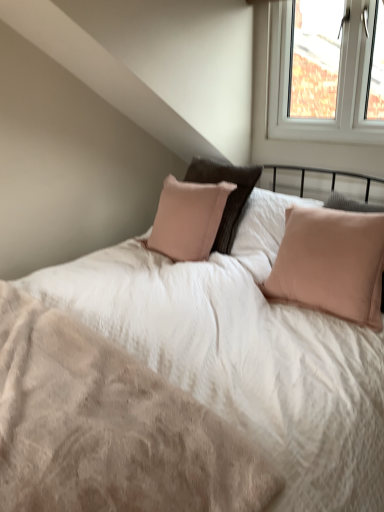
Where is `white plastic window at upper right`? The width and height of the screenshot is (384, 512). white plastic window at upper right is located at coordinates (326, 71).

What do you see at coordinates (108, 426) in the screenshot? I see `beige soft fabric mattress at center` at bounding box center [108, 426].

Measure the distance between point (199, 463) and camera.

Point (199, 463) is 33.62 inches from camera.

Where is `pale pink fabric pillow at right`? This screenshot has width=384, height=512. pale pink fabric pillow at right is located at coordinates (331, 263).

Is white plastic window at upper right bigger than beige soft fabric mattress at center?

Actually, white plastic window at upper right might be smaller than beige soft fabric mattress at center.

Consider the image. Is beige soft fabric mattress at center inside white plastic window at upper right?

Definitely not — beige soft fabric mattress at center is not inside white plastic window at upper right.

From a real-world perspective, is white plastic window at upper right physically located above or below beige soft fabric mattress at center?

Clearly, from a real-world perspective, white plastic window at upper right is above beige soft fabric mattress at center.

Visually, is white plastic window at upper right positioned to the left or to the right of beige soft fabric mattress at center?

white plastic window at upper right is positioned on beige soft fabric mattress at center's right side.

Which of these two, pale pink fabric pillow at right or white plastic window at upper right, is bigger?

With larger size is pale pink fabric pillow at right.

Considering the sizes of objects pale pink fabric pillow at right and white plastic window at upper right in the image provided, who is shorter, pale pink fabric pillow at right or white plastic window at upper right?

With less height is pale pink fabric pillow at right.

Is pale pink fabric pillow at right not inside white plastic window at upper right?

Yes, pale pink fabric pillow at right is located beyond the bounds of white plastic window at upper right.

Could you tell me if pale pink fabric pillow at right is facing white plastic window at upper right?

No.

How much distance is there between beige soft fabric mattress at center and white plastic window at upper right?

6.36 feet.

Is beige soft fabric mattress at center spatially inside white plastic window at upper right, or outside of it?

beige soft fabric mattress at center is spatially situated outside white plastic window at upper right.

Is beige soft fabric mattress at center turned away from white plastic window at upper right?

No, beige soft fabric mattress at center is not facing the opposite direction of white plastic window at upper right.

From the image's perspective, is beige soft fabric mattress at center on white plastic window at upper right?

No, from the image's perspective, beige soft fabric mattress at center is not on top of white plastic window at upper right.

From the image's perspective, is beige soft fabric mattress at center under pale pink fabric pillow at right?

Yes, from the image's perspective, beige soft fabric mattress at center is below pale pink fabric pillow at right.

Based on the photo, who is bigger, beige soft fabric mattress at center or pale pink fabric pillow at right?

With larger size is pale pink fabric pillow at right.

At what (x,y) coordinates should I click in order to perform the action: click on mattress lying in front of the pale pink fabric pillow at right. Please return your answer as a coordinate pair (x, y). This screenshot has width=384, height=512. Looking at the image, I should click on (108, 426).

How different are the orientations of beige soft fabric mattress at center and pale pink fabric pillow at right in degrees?

There is a 0.58-degree angle between the facing directions of beige soft fabric mattress at center and pale pink fabric pillow at right.

From the image's perspective, is white plastic window at upper right under pale pink fabric pillow at right?

Actually, white plastic window at upper right appears above pale pink fabric pillow at right in the image.

Would you say white plastic window at upper right is to the left or to the right of pale pink fabric pillow at right in the picture?

In the image, white plastic window at upper right appears on the right side of pale pink fabric pillow at right.

Is white plastic window at upper right positioned before pale pink fabric pillow at right?

No, it is not.

Which is less distant, [318,113] or [317,216]?

Point [318,113].

Is pale pink fabric pillow at right next to beige soft fabric mattress at center?

pale pink fabric pillow at right and beige soft fabric mattress at center are not in contact.

Which is correct: pale pink fabric pillow at right is inside beige soft fabric mattress at center, or outside of it?

pale pink fabric pillow at right is not enclosed by beige soft fabric mattress at center.

From the image's perspective, which object appears higher, pale pink fabric pillow at right or beige soft fabric mattress at center?

pale pink fabric pillow at right is shown above in the image.

Which object is positioned more to the right, pale pink fabric pillow at right or beige soft fabric mattress at center?

Positioned to the right is pale pink fabric pillow at right.

The width and height of the screenshot is (384, 512). Find the location of `mattress below the white plastic window at upper right (from a real-world perspective)`. mattress below the white plastic window at upper right (from a real-world perspective) is located at coordinates (108, 426).

Locate an element on the screen. This screenshot has width=384, height=512. window located above the pale pink fabric pillow at right (from the image's perspective) is located at coordinates (326, 71).

Which object lies nearer to the anchor point pale pink fabric pillow at right, white plastic window at upper right or beige soft fabric mattress at center?

Among the two, beige soft fabric mattress at center is located nearer to pale pink fabric pillow at right.

When comparing their distances from beige soft fabric mattress at center, does pale pink fabric pillow at right or white plastic window at upper right seem closer?

pale pink fabric pillow at right is positioned closer to the anchor beige soft fabric mattress at center.

Consider the image. Based on their spatial positions, is pale pink fabric pillow at right or beige soft fabric mattress at center closer to white plastic window at upper right?

pale pink fabric pillow at right is closer to white plastic window at upper right.

Estimate the real-world distances between objects in this image. Which object is closer to white plastic window at upper right, beige soft fabric mattress at center or pale pink fabric pillow at right?

Based on the image, pale pink fabric pillow at right appears to be nearer to white plastic window at upper right.

Considering their positions, is beige soft fabric mattress at center positioned closer to pale pink fabric pillow at right than white plastic window at upper right?

Among the two, beige soft fabric mattress at center is located nearer to pale pink fabric pillow at right.

When comparing their distances from beige soft fabric mattress at center, does white plastic window at upper right or pale pink fabric pillow at right seem closer?

Among the two, pale pink fabric pillow at right is located nearer to beige soft fabric mattress at center.

Locate an element on the screen. Image resolution: width=384 pixels, height=512 pixels. pillow that lies between white plastic window at upper right and beige soft fabric mattress at center from top to bottom is located at coordinates (331, 263).